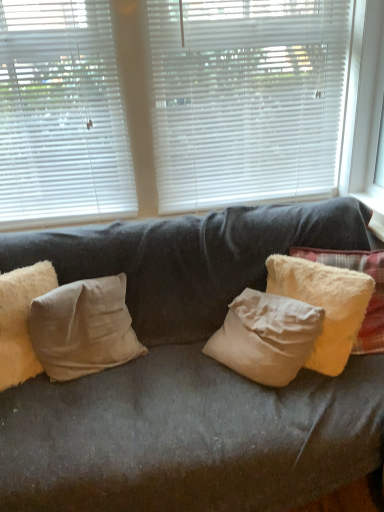
Question: From the image's perspective, is white matte blinds at upper left, which is counted as the second window blind, starting from the right, positioned above or below beige cotton pillow at left, positioned as the second pillow in right-to-left order?

Choices:
 (A) below
 (B) above

Answer: (B)

Question: Is white matte blinds at upper left, the 1th window blind when ordered from left to right, spatially inside beige cotton pillow at left, positioned as the second pillow in right-to-left order, or outside of it?

Choices:
 (A) outside
 (B) inside

Answer: (A)

Question: Based on their relative distances, which object is farther from the white matte blinds at upper left, which is counted as the second window blind, starting from the right?

Choices:
 (A) beige cotton pillow at left, the 3th pillow viewed from the right
 (B) beige cotton pillow at left, positioned as the second pillow in right-to-left order
 (C) white matte blinds at upper center, positioned as the 2th window blind in left-to-right order
 (D) fuzzy yellow pillow at right, the 1th pillow when ordered from right to left
 (E) white plastic window frame at upper right

Answer: (E)

Question: Estimate the real-world distances between objects in this image. Which object is farther from the white plastic window frame at upper right?

Choices:
 (A) fuzzy yellow pillow at right, the 1th pillow when ordered from right to left
 (B) white matte blinds at upper center, which is counted as the first window blind, starting from the right
 (C) white matte blinds at upper left, the 1th window blind when ordered from left to right
 (D) beige cotton pillow at left, the 3th pillow viewed from the right
 (E) beige cotton pillow at left, positioned as the second pillow in right-to-left order

Answer: (D)